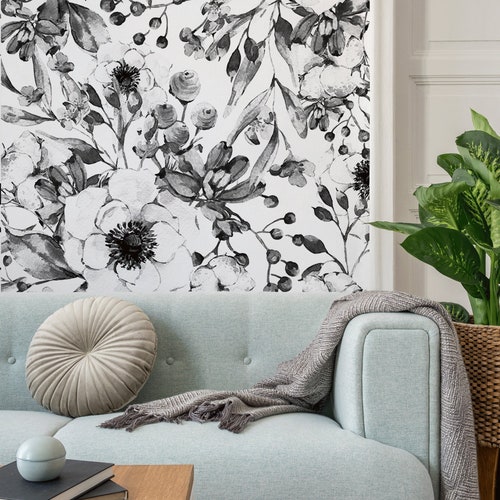
Image resolution: width=500 pixels, height=500 pixels. Identify the location of table. (156, 480).